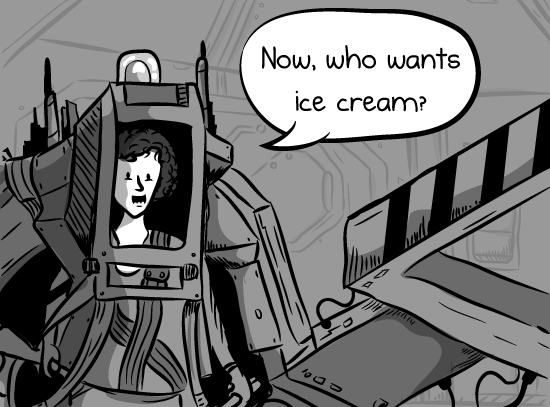
Image resolution: width=550 pixels, height=407 pixels. In order to click on white rounded light on top of box containing cartoon man in this screenshot , I will do `click(135, 68)`, `click(152, 61)`.